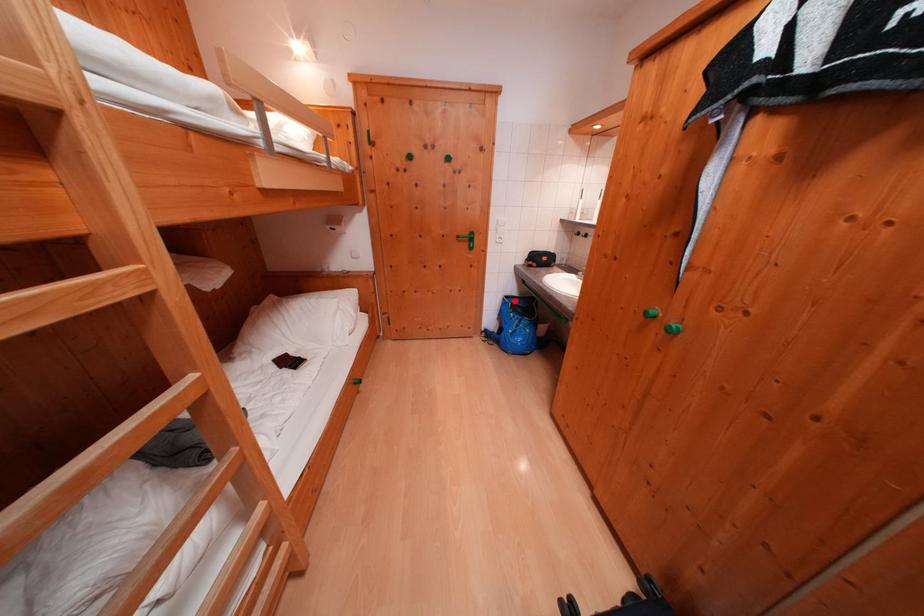
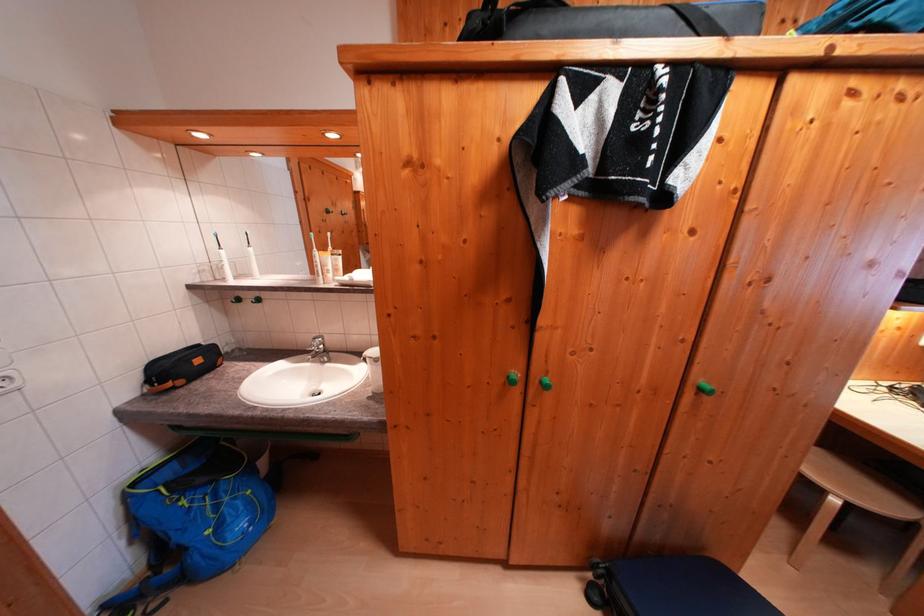
In the second image, find the point that corresponds to the highlighted location in the first image.

(142, 488)